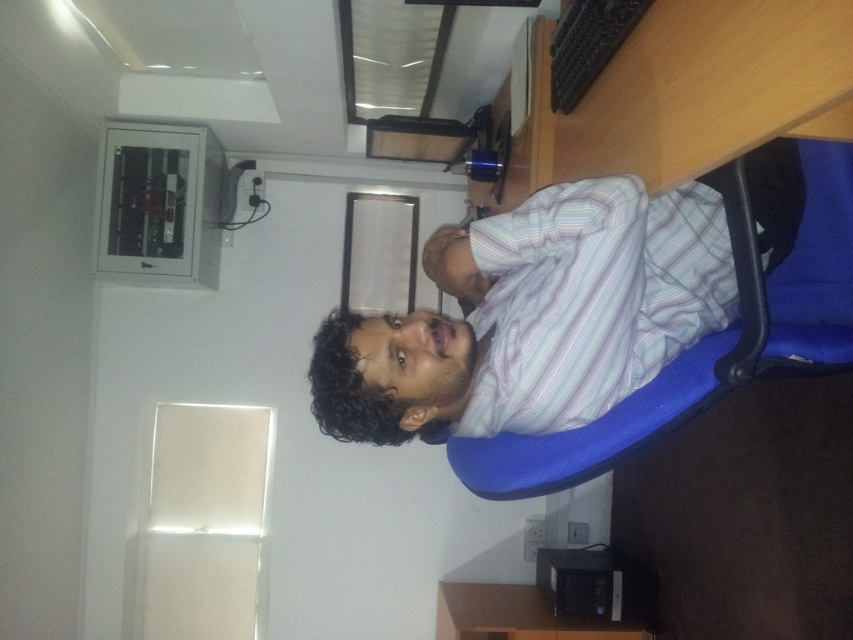
Question: Which object is closer to the camera taking this photo?

Choices:
 (A) black plastic computer at lower center
 (B) white striped shirt at center

Answer: (B)

Question: Is the position of white striped shirt at center more distant than that of black plastic computer at lower center?

Choices:
 (A) yes
 (B) no

Answer: (B)

Question: Can you confirm if white striped shirt at center is wider than black plastic computer at lower center?

Choices:
 (A) yes
 (B) no

Answer: (A)

Question: Can you confirm if white striped shirt at center is positioned below black plastic computer at lower center?

Choices:
 (A) no
 (B) yes

Answer: (A)